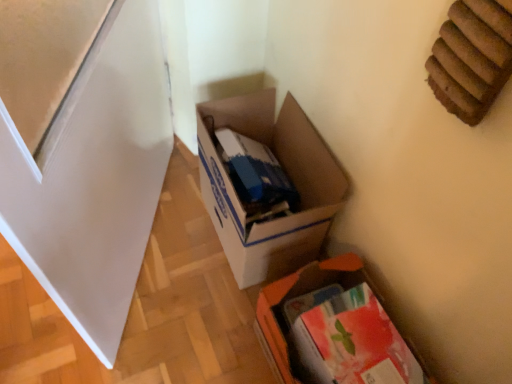
This screenshot has height=384, width=512. What do you see at coordinates (288, 175) in the screenshot? I see `white cardboard box at center, which is the 2th box in bottom-to-top order` at bounding box center [288, 175].

What is the approximate height of white cardboard box at center, which appears as the 1th box when viewed from the top?

white cardboard box at center, which appears as the 1th box when viewed from the top, is 40.01 centimeters tall.

Image resolution: width=512 pixels, height=384 pixels. What are the coordinates of `white cardboard box at center, which appears as the 1th box when viewed from the top` in the screenshot? It's located at tap(288, 175).

What do you see at coordinates (332, 328) in the screenshot? I see `orange fabric box at lower right, the first box in the bottom-to-top sequence` at bounding box center [332, 328].

You are a GUI agent. You are given a task and a screenshot of the screen. Output one action in this format:
    pyautogui.click(x=<x>, y=<y>)
    Task: Click on the orange fabric box at lower right, which ranks as the 2th box in top-to-bottom order
    
    Given the screenshot: What is the action you would take?
    pyautogui.click(x=332, y=328)

You are a GUI agent. You are given a task and a screenshot of the screen. Output one action in this format:
    pyautogui.click(x=<x>, y=<y>)
    Task: Click on the white cardboard box at center, which appears as the 1th box when viewed from the top
    This screenshot has width=512, height=384.
    Given the screenshot: What is the action you would take?
    pyautogui.click(x=288, y=175)

Considering the positions of objects white cardboard box at center, which appears as the 1th box when viewed from the top, and orange fabric box at lower right, which ranks as the 2th box in top-to-bottom order, in the image provided, who is more to the left, white cardboard box at center, which appears as the 1th box when viewed from the top, or orange fabric box at lower right, which ranks as the 2th box in top-to-bottom order,?

white cardboard box at center, which appears as the 1th box when viewed from the top, is more to the left.

Which object is further away from the camera taking this photo, white cardboard box at center, which appears as the 1th box when viewed from the top, or orange fabric box at lower right, which ranks as the 2th box in top-to-bottom order?

white cardboard box at center, which appears as the 1th box when viewed from the top, is behind.

Considering the positions of point (202, 170) and point (419, 375), is point (202, 170) closer or farther from the camera than point (419, 375)?

Point (202, 170) is positioned farther from the camera compared to point (419, 375).

From the image's perspective, is white cardboard box at center, which is the 2th box in bottom-to-top order, under orange fabric box at lower right, which ranks as the 2th box in top-to-bottom order?

Answer: No, from the image's perspective, white cardboard box at center, which is the 2th box in bottom-to-top order, is not beneath orange fabric box at lower right, which ranks as the 2th box in top-to-bottom order.

From a real-world perspective, is white cardboard box at center, which is the 2th box in bottom-to-top order, physically located above or below orange fabric box at lower right, which ranks as the 2th box in top-to-bottom order?

Clearly, from a real-world perspective, white cardboard box at center, which is the 2th box in bottom-to-top order, is below orange fabric box at lower right, which ranks as the 2th box in top-to-bottom order.

Which of these two, white cardboard box at center, which appears as the 1th box when viewed from the top, or orange fabric box at lower right, the first box in the bottom-to-top sequence, is thinner?

With smaller width is orange fabric box at lower right, the first box in the bottom-to-top sequence.

Is white cardboard box at center, which is the 2th box in bottom-to-top order, taller than orange fabric box at lower right, the first box in the bottom-to-top sequence?

Yes, white cardboard box at center, which is the 2th box in bottom-to-top order, is taller than orange fabric box at lower right, the first box in the bottom-to-top sequence.

Consider the image. Considering the sizes of objects white cardboard box at center, which appears as the 1th box when viewed from the top, and orange fabric box at lower right, which ranks as the 2th box in top-to-bottom order, in the image provided, who is smaller, white cardboard box at center, which appears as the 1th box when viewed from the top, or orange fabric box at lower right, which ranks as the 2th box in top-to-bottom order,?

With smaller size is orange fabric box at lower right, which ranks as the 2th box in top-to-bottom order.

Is white cardboard box at center, which is the 2th box in bottom-to-top order, inside the boundaries of orange fabric box at lower right, which ranks as the 2th box in top-to-bottom order, or outside?

white cardboard box at center, which is the 2th box in bottom-to-top order, cannot be found inside orange fabric box at lower right, which ranks as the 2th box in top-to-bottom order.

Is there a large distance between white cardboard box at center, which is the 2th box in bottom-to-top order, and orange fabric box at lower right, which ranks as the 2th box in top-to-bottom order?

white cardboard box at center, which is the 2th box in bottom-to-top order, is actually quite close to orange fabric box at lower right, which ranks as the 2th box in top-to-bottom order.

Is white cardboard box at center, which appears as the 1th box when viewed from the top, oriented towards orange fabric box at lower right, which ranks as the 2th box in top-to-bottom order?

No, white cardboard box at center, which appears as the 1th box when viewed from the top, is not aimed at orange fabric box at lower right, which ranks as the 2th box in top-to-bottom order.

At what (x,y) coordinates should I click in order to perform the action: click on box that is behind the orange fabric box at lower right, the first box in the bottom-to-top sequence. Please return your answer as a coordinate pair (x, y). Image resolution: width=512 pixels, height=384 pixels. Looking at the image, I should click on (288, 175).

Looking at this image, is orange fabric box at lower right, the first box in the bottom-to-top sequence, to the left of white cardboard box at center, which is the 2th box in bottom-to-top order, from the viewer's perspective?

No, orange fabric box at lower right, the first box in the bottom-to-top sequence, is not to the left of white cardboard box at center, which is the 2th box in bottom-to-top order.

Looking at this image, relative to white cardboard box at center, which is the 2th box in bottom-to-top order, is orange fabric box at lower right, the first box in the bottom-to-top sequence, in front or behind?

In the image, orange fabric box at lower right, the first box in the bottom-to-top sequence, appears in front of white cardboard box at center, which is the 2th box in bottom-to-top order.

Which point is more forward, [387,314] or [330,180]?

Point [387,314]

In the scene shown: From the image's perspective, would you say orange fabric box at lower right, which ranks as the 2th box in top-to-bottom order, is shown under white cardboard box at center, which is the 2th box in bottom-to-top order?

Correct, orange fabric box at lower right, which ranks as the 2th box in top-to-bottom order, appears lower than white cardboard box at center, which is the 2th box in bottom-to-top order, in the image.

From a real-world perspective, which is physically above, orange fabric box at lower right, the first box in the bottom-to-top sequence, or white cardboard box at center, which appears as the 1th box when viewed from the top?

orange fabric box at lower right, the first box in the bottom-to-top sequence, from a real-world perspective.

Considering the sizes of orange fabric box at lower right, which ranks as the 2th box in top-to-bottom order, and white cardboard box at center, which appears as the 1th box when viewed from the top, in the image, is orange fabric box at lower right, which ranks as the 2th box in top-to-bottom order, wider or thinner than white cardboard box at center, which appears as the 1th box when viewed from the top,?

In the image, orange fabric box at lower right, which ranks as the 2th box in top-to-bottom order, appears to be more narrow than white cardboard box at center, which appears as the 1th box when viewed from the top.

Based on the photo, is orange fabric box at lower right, the first box in the bottom-to-top sequence, taller or shorter than white cardboard box at center, which appears as the 1th box when viewed from the top?

Clearly, orange fabric box at lower right, the first box in the bottom-to-top sequence, is shorter compared to white cardboard box at center, which appears as the 1th box when viewed from the top.

From the picture: Considering the sizes of orange fabric box at lower right, which ranks as the 2th box in top-to-bottom order, and white cardboard box at center, which appears as the 1th box when viewed from the top, in the image, is orange fabric box at lower right, which ranks as the 2th box in top-to-bottom order, bigger or smaller than white cardboard box at center, which appears as the 1th box when viewed from the top,?

Clearly, orange fabric box at lower right, which ranks as the 2th box in top-to-bottom order, is smaller in size than white cardboard box at center, which appears as the 1th box when viewed from the top.

Choose the correct answer: Is orange fabric box at lower right, which ranks as the 2th box in top-to-bottom order, inside white cardboard box at center, which appears as the 1th box when viewed from the top, or outside it?

orange fabric box at lower right, which ranks as the 2th box in top-to-bottom order, is located beyond the bounds of white cardboard box at center, which appears as the 1th box when viewed from the top.

Would you consider orange fabric box at lower right, which ranks as the 2th box in top-to-bottom order, to be distant from white cardboard box at center, which is the 2th box in bottom-to-top order?

Actually, orange fabric box at lower right, which ranks as the 2th box in top-to-bottom order, and white cardboard box at center, which is the 2th box in bottom-to-top order, are a little close together.

Is orange fabric box at lower right, which ranks as the 2th box in top-to-bottom order, looking in the opposite direction of white cardboard box at center, which is the 2th box in bottom-to-top order?

That's not correct — orange fabric box at lower right, which ranks as the 2th box in top-to-bottom order, is not looking away from white cardboard box at center, which is the 2th box in bottom-to-top order.

Can you tell me how much orange fabric box at lower right, which ranks as the 2th box in top-to-bottom order, and white cardboard box at center, which is the 2th box in bottom-to-top order, differ in facing direction?

They differ by 0.00235 degrees in their facing directions.

Based on the photo, measure the distance from orange fabric box at lower right, which ranks as the 2th box in top-to-bottom order, to white cardboard box at center, which is the 2th box in bottom-to-top order.

orange fabric box at lower right, which ranks as the 2th box in top-to-bottom order, and white cardboard box at center, which is the 2th box in bottom-to-top order, are 10.27 inches apart.

I want to click on box above the white cardboard box at center, which is the 2th box in bottom-to-top order (from a real-world perspective), so click(332, 328).

At what (x,y) coordinates should I click in order to perform the action: click on box in front of the white cardboard box at center, which is the 2th box in bottom-to-top order. Please return your answer as a coordinate pair (x, y). Looking at the image, I should click on (332, 328).

Identify the location of box above the white cardboard box at center, which appears as the 1th box when viewed from the top (from a real-world perspective). (332, 328).